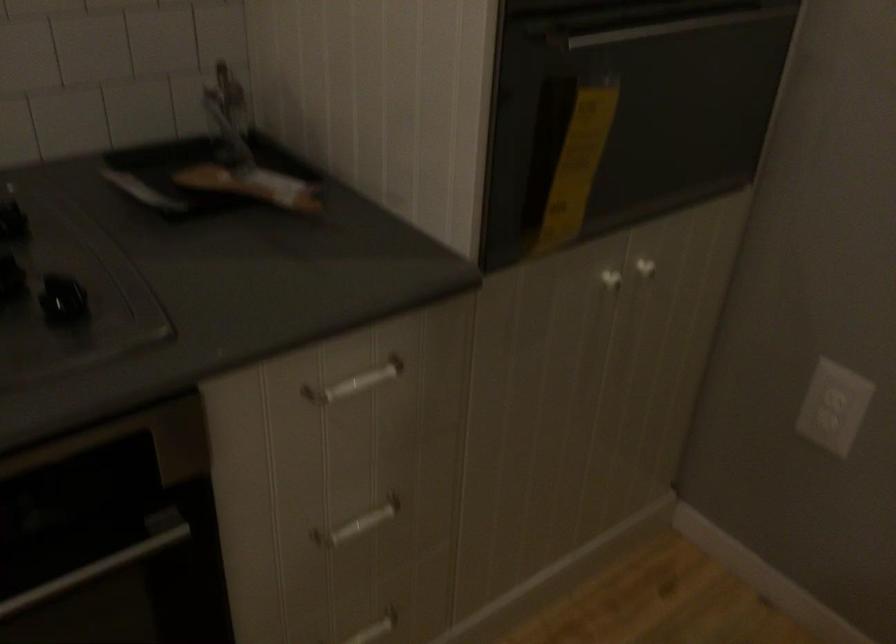
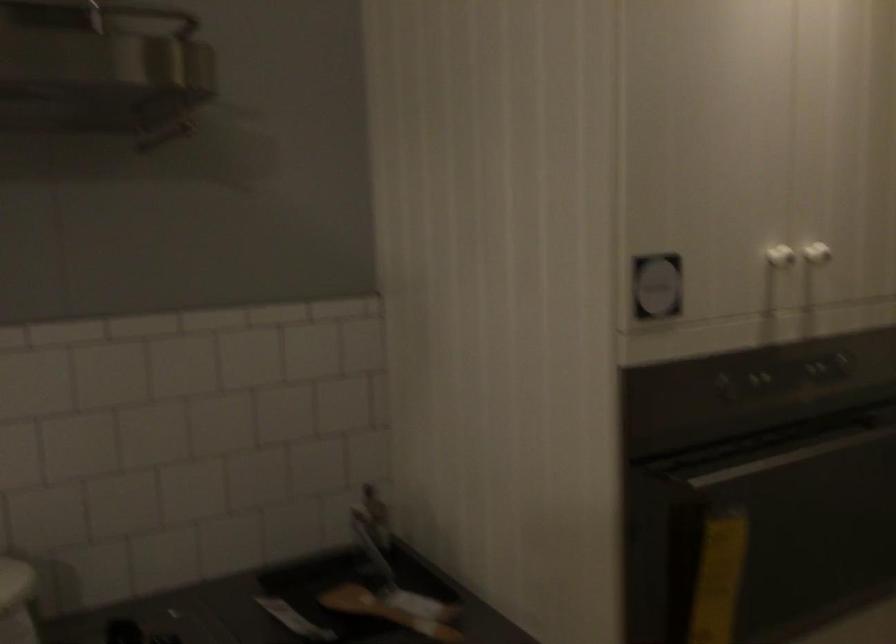
Question: How did the camera likely rotate?

Choices:
 (A) Left
 (B) Right
 (C) Up
 (D) Down

Answer: (C)